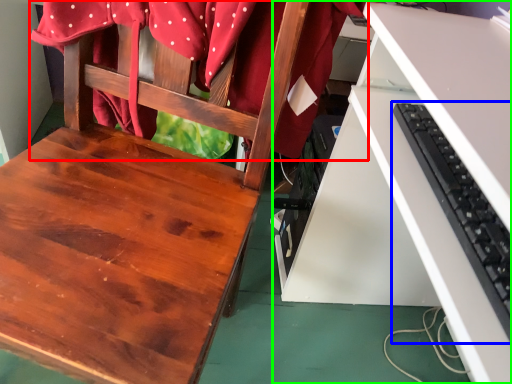
Question: Which object is positioned farthest from fabric (highlighted by a red box)? Select from computer keyboard (highlighted by a blue box) and desk (highlighted by a green box).

Choices:
 (A) computer keyboard
 (B) desk

Answer: (A)